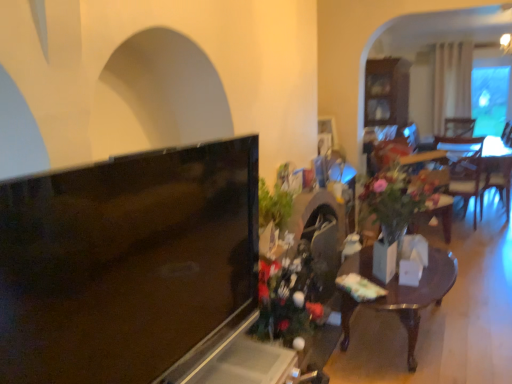
Question: Considering the positions of green leafy plant at center-right and matte black tv at left in the image, is green leafy plant at center-right wider or thinner than matte black tv at left?

Choices:
 (A) thin
 (B) wide

Answer: (B)

Question: From a real-world perspective, relative to matte black tv at left, is green leafy plant at center-right vertically above or below?

Choices:
 (A) above
 (B) below

Answer: (B)

Question: Based on their relative distances, which object is nearer to the wooden table at center?

Choices:
 (A) matte black tv at left
 (B) white glossy vase at center
 (C) green leafy plant at center-right

Answer: (B)

Question: Which is nearer to the wooden table at center?

Choices:
 (A) matte black tv at left
 (B) green leafy plant at center-right
 (C) white glossy vase at center

Answer: (C)